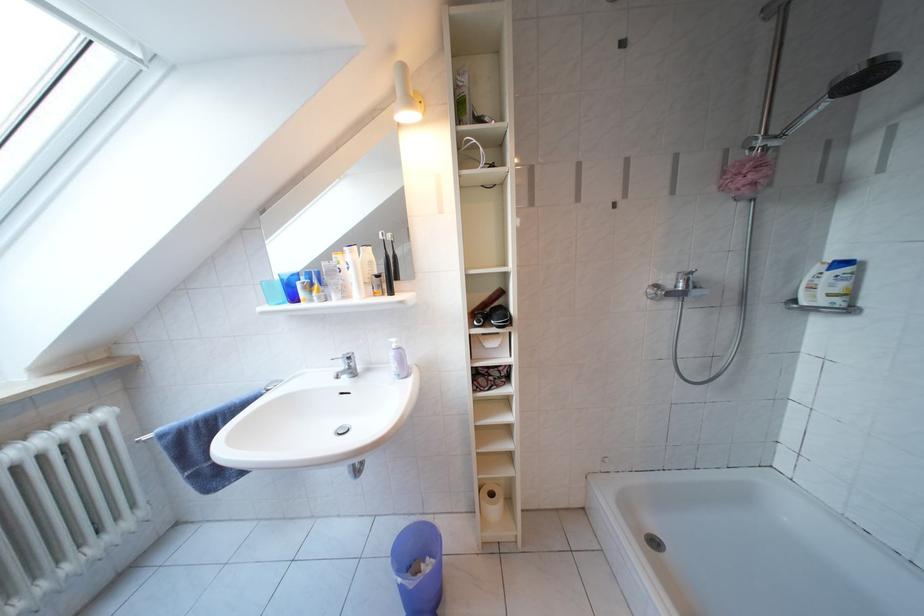
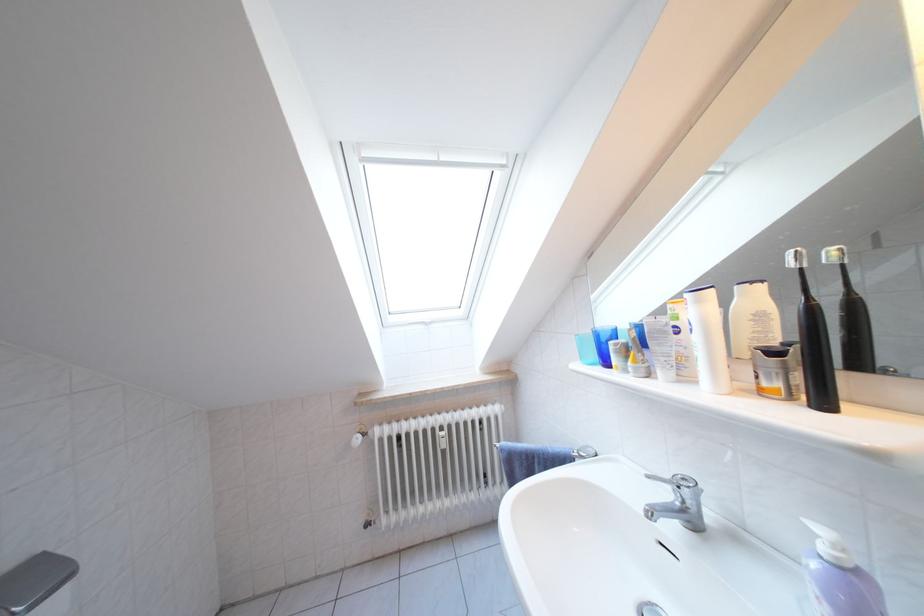
The point at [359,257] is marked in the first image. Where is the corresponding point in the second image?

(708, 306)